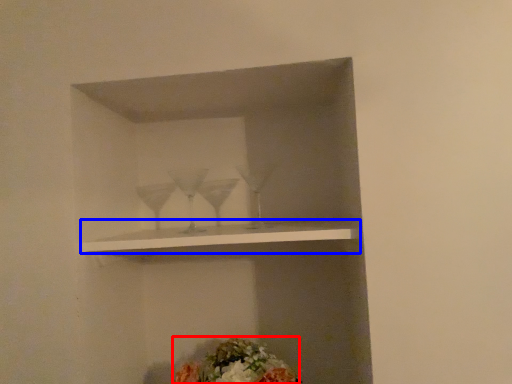
Question: Which object is closer to the camera taking this photo, flower (highlighted by a red box) or shelf (highlighted by a blue box)?

Choices:
 (A) flower
 (B) shelf

Answer: (B)